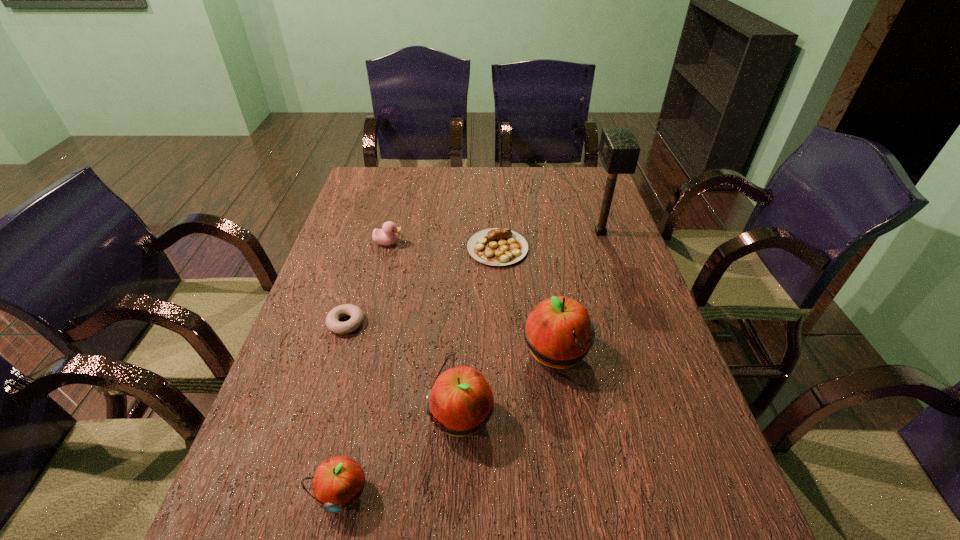
I want to click on vacant area between the doughnut and the steak, so click(421, 286).

This screenshot has width=960, height=540. What are the coordinates of `unoccupied area between the doughnut and the mallet` in the screenshot? It's located at (473, 278).

Where is `free space that is in between the second shortest apple and the rightmost apple`? This screenshot has width=960, height=540. free space that is in between the second shortest apple and the rightmost apple is located at coordinates (509, 386).

Where is `empty space that is in between the mallet and the steak`? The height and width of the screenshot is (540, 960). empty space that is in between the mallet and the steak is located at coordinates (549, 241).

I want to click on free space between the steak and the third tallest object, so click(x=480, y=332).

The image size is (960, 540). I want to click on free spot between the duckling and the nearest apple, so click(x=365, y=368).

This screenshot has height=540, width=960. Find the location of `object that ranks as the closest to the steak`. object that ranks as the closest to the steak is located at coordinates (619, 150).

Choose which object is the nearest neighbor to the second apple from left to right. Please provide its 2D coordinates. Your answer should be formatted as a tuple, i.e. [(x, y)], where the tuple contains the x and y coordinates of a point satisfying the conditions above.

[(559, 333)]

Identify the location of the closest apple to the shortest apple. (460, 402).

Where is `apple that stands as the closest to the duckling`? This screenshot has height=540, width=960. apple that stands as the closest to the duckling is located at coordinates (559, 333).